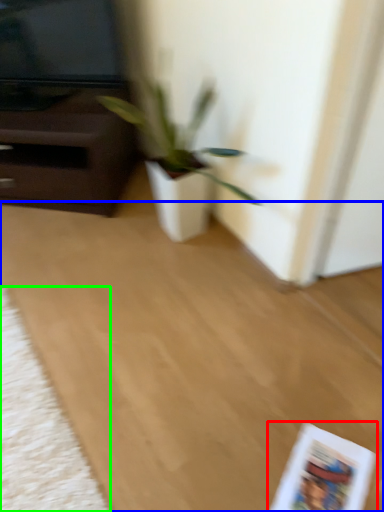
Question: Estimate the real-world distances between objects in this image. Which object is farther from paperback book (highlighted by a red box), plain (highlighted by a blue box) or mat (highlighted by a green box)?

Choices:
 (A) plain
 (B) mat

Answer: (B)